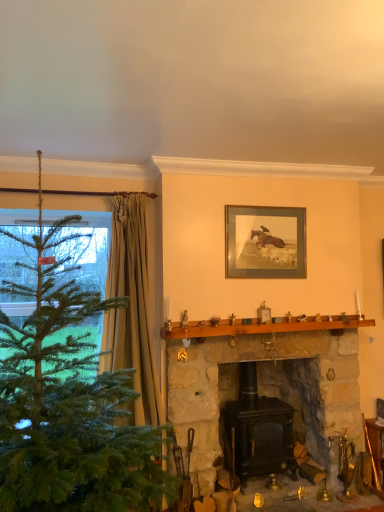
Question: From the image's perspective, is beige textured curtain at left located above or below stone fireplace at center, which is the 1th fireplace in left-to-right order?

Choices:
 (A) above
 (B) below

Answer: (A)

Question: Relative to stone fireplace at center, which is the 1th fireplace in left-to-right order, is beige textured curtain at left in front or behind?

Choices:
 (A) front
 (B) behind

Answer: (B)

Question: Which object is positioned farthest from the beige textured curtain at left?

Choices:
 (A) stone fireplace at center, the 2th fireplace viewed from the right
 (B) black matte wood stove at center, the 1th fireplace in the right-to-left sequence
 (C) wooden fireplace tools at lower right
 (D) green matte christmas tree at left
 (E) brown wooden mantle at center

Answer: (C)

Question: Which of these objects is positioned closest to the beige textured curtain at left?

Choices:
 (A) green matte christmas tree at left
 (B) black matte wood stove at center, the 1th fireplace in the right-to-left sequence
 (C) brown wooden mantle at center
 (D) wooden fireplace tools at lower right
 (E) stone fireplace at center, which is the 1th fireplace in left-to-right order

Answer: (C)